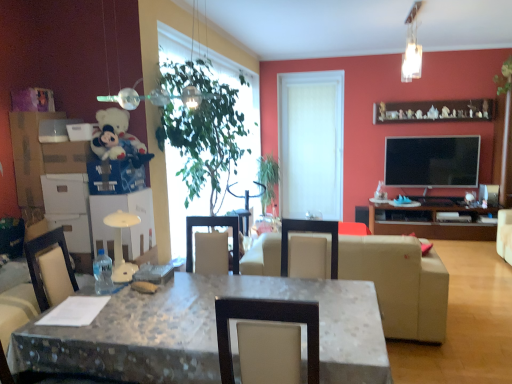
Question: From the image's perspective, is wooden figurines at upper right on metallic glass pendant light at upper center, which ranks as the first lamp in bottom-to-top order?

Choices:
 (A) yes
 (B) no

Answer: (A)

Question: Is wooden figurines at upper right thinner than metallic glass pendant light at upper center, arranged as the 2th lamp when viewed from the top?

Choices:
 (A) yes
 (B) no

Answer: (A)

Question: Does wooden figurines at upper right come in front of metallic glass pendant light at upper center, arranged as the 2th lamp when viewed from the top?

Choices:
 (A) no
 (B) yes

Answer: (A)

Question: Does wooden figurines at upper right have a smaller size compared to metallic glass pendant light at upper center, which ranks as the first lamp in bottom-to-top order?

Choices:
 (A) no
 (B) yes

Answer: (A)

Question: Is wooden figurines at upper right aimed at metallic glass pendant light at upper center, which is the second lamp from right to left?

Choices:
 (A) no
 (B) yes

Answer: (B)

Question: Is metallic glass pendant light at upper center, which is the 2th lamp from back to front, located within wooden figurines at upper right?

Choices:
 (A) yes
 (B) no

Answer: (B)

Question: Can you confirm if green leafy plant at upper right, the first plant positioned from the front, is taller than translucent glass pendant light at upper right, which appears as the second lamp when ordered from the bottom?

Choices:
 (A) yes
 (B) no

Answer: (B)

Question: From a real-world perspective, is green leafy plant at upper right, the 2th plant viewed from the left, below translucent glass pendant light at upper right, positioned as the 2th lamp in front-to-back order?

Choices:
 (A) no
 (B) yes

Answer: (B)

Question: From the image's perspective, is green leafy plant at upper right, placed as the 1th plant when sorted from right to left, located above translucent glass pendant light at upper right, positioned as the first lamp in top-to-bottom order?

Choices:
 (A) no
 (B) yes

Answer: (B)

Question: Is green leafy plant at upper right, the 2th plant viewed from the left, not within translucent glass pendant light at upper right, the first lamp in the back-to-front sequence?

Choices:
 (A) no
 (B) yes

Answer: (B)

Question: Is green leafy plant at upper right, which is counted as the 1th plant, starting from the top, at the left side of translucent glass pendant light at upper right, positioned as the 2th lamp in front-to-back order?

Choices:
 (A) no
 (B) yes

Answer: (A)

Question: Is green leafy plant at upper right, the second plant in the bottom-to-top sequence, wider than translucent glass pendant light at upper right, positioned as the 2th lamp in front-to-back order?

Choices:
 (A) no
 (B) yes

Answer: (A)

Question: From a real-world perspective, is green leafy plant at upper right, the 2th plant viewed from the left, located beneath green leafy plant at center?

Choices:
 (A) yes
 (B) no

Answer: (B)